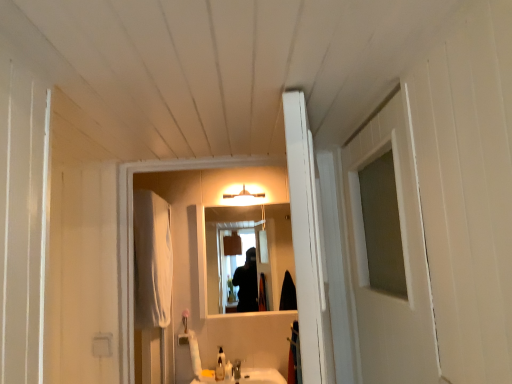
Question: Would you consider white fabric curtain at left to be distant from translucent plastic soap at center?

Choices:
 (A) no
 (B) yes

Answer: (A)

Question: Is white fabric curtain at left aimed at translucent plastic soap at center?

Choices:
 (A) yes
 (B) no

Answer: (B)

Question: Is translucent plastic soap at center surrounded by white fabric curtain at left?

Choices:
 (A) no
 (B) yes

Answer: (A)

Question: Considering the relative sizes of white fabric curtain at left and translucent plastic soap at center in the image provided, is white fabric curtain at left taller than translucent plastic soap at center?

Choices:
 (A) no
 (B) yes

Answer: (B)

Question: Can you confirm if white fabric curtain at left is positioned to the right of translucent plastic soap at center?

Choices:
 (A) no
 (B) yes

Answer: (A)

Question: Is the position of white fabric curtain at left more distant than that of translucent plastic soap at center?

Choices:
 (A) yes
 (B) no

Answer: (B)

Question: Is white wooden door at center thinner than clear glass mirror at center?

Choices:
 (A) yes
 (B) no

Answer: (B)

Question: Can we say white wooden door at center lies outside clear glass mirror at center?

Choices:
 (A) yes
 (B) no

Answer: (A)

Question: Does white wooden door at center come behind clear glass mirror at center?

Choices:
 (A) yes
 (B) no

Answer: (B)

Question: Is white wooden door at center bigger than clear glass mirror at center?

Choices:
 (A) no
 (B) yes

Answer: (B)

Question: Can you confirm if white wooden door at center is shorter than clear glass mirror at center?

Choices:
 (A) no
 (B) yes

Answer: (B)

Question: From the image's perspective, does white wooden door at center appear lower than clear glass mirror at center?

Choices:
 (A) yes
 (B) no

Answer: (B)

Question: Could you tell me if satin nickel faucet at lower center is facing matte white light fixture at upper center?

Choices:
 (A) yes
 (B) no

Answer: (B)